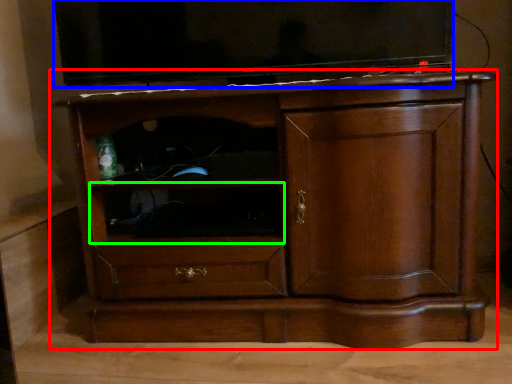
Question: Which object is the farthest from chest of drawers (highlighted by a red box)? Choose among these: television (highlighted by a blue box) or shelf (highlighted by a green box).

Choices:
 (A) television
 (B) shelf

Answer: (A)